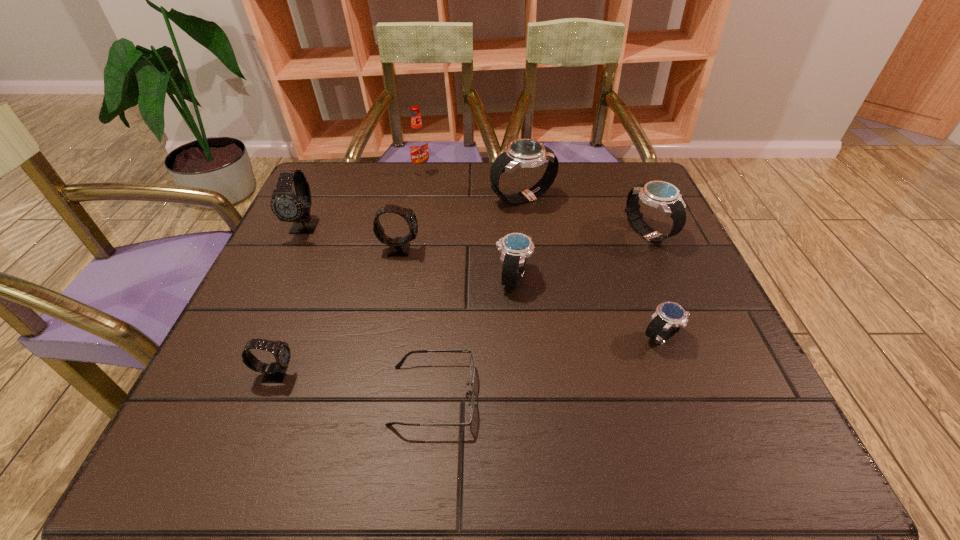
Locate an element on the screen. vacant space in between the fifth watch from right to left and the nearest gray watch is located at coordinates (338, 312).

Image resolution: width=960 pixels, height=540 pixels. Identify the location of empty space that is in between the farthest silver watch and the smallest silver watch. (591, 268).

At what (x,y) coordinates should I click in order to perform the action: click on free spot between the second farthest object and the farthest object. Please return your answer as a coordinate pair (x, y). The image size is (960, 540). Looking at the image, I should click on (472, 185).

I want to click on free spot between the biggest silver watch and the third smallest silver watch, so click(585, 216).

Identify the location of the third closest object to the biggest gray watch. This screenshot has height=540, width=960. (273, 373).

Find the location of a particular element. object that stands as the third closest to the farthest watch is located at coordinates (515, 247).

Locate which watch is the closest to the nearest gray watch. Please provide its 2D coordinates. Your answer should be formatted as a tuple, i.e. [(x, y)], where the tuple contains the x and y coordinates of a point satisfying the conditions above.

[(399, 247)]

Find the location of a particular element. The width and height of the screenshot is (960, 540). watch that is the sixth nearest to the spectacles is located at coordinates (525, 153).

Where is `silver watch that is the second closest to the second biggest silver watch`? This screenshot has height=540, width=960. silver watch that is the second closest to the second biggest silver watch is located at coordinates (669, 317).

Choose which silver watch is the fourth nearest neighbor to the farthest object. Please provide its 2D coordinates. Your answer should be formatted as a tuple, i.e. [(x, y)], where the tuple contains the x and y coordinates of a point satisfying the conditions above.

[(669, 317)]